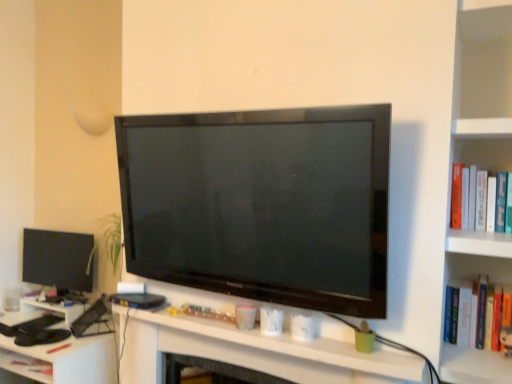
Where is `blank space situated above matte black computer at center (from a real-world perspective)`? blank space situated above matte black computer at center (from a real-world perspective) is located at coordinates (259, 327).